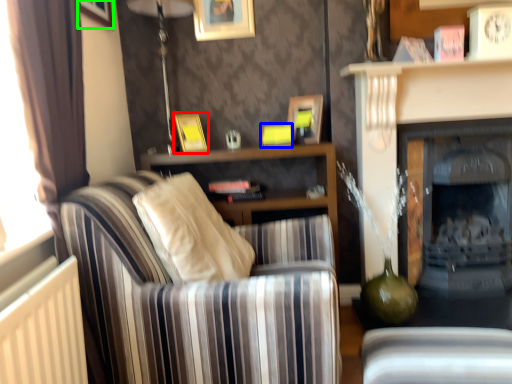
Question: Based on their relative distances, which object is farther from picture frame (highlighted by a red box)? Choose from picture frame (highlighted by a blue box) and picture frame (highlighted by a green box).

Choices:
 (A) picture frame
 (B) picture frame

Answer: (B)